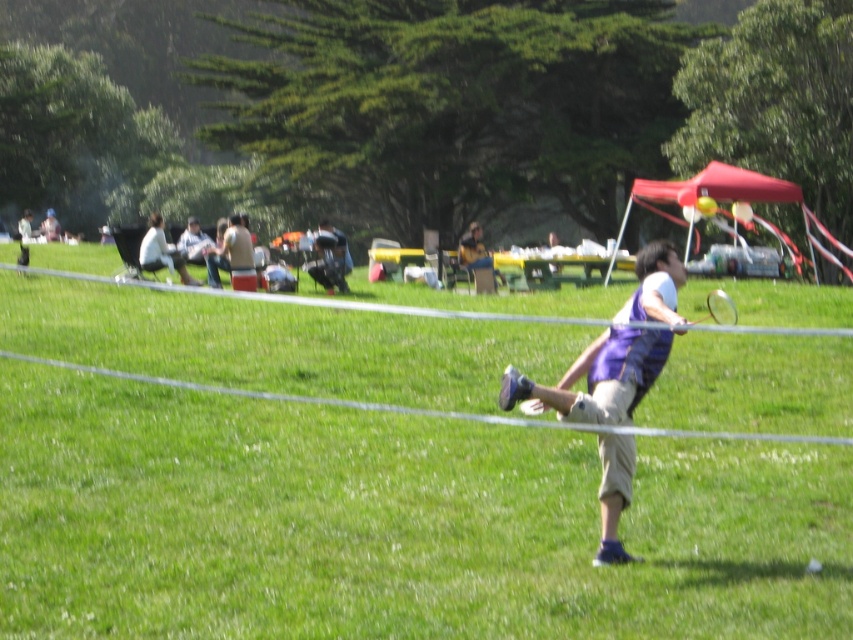
Is point (677, 493) positioned behind point (607, 500)?

Yes, it is behind point (607, 500).

What do you see at coordinates (370, 481) in the screenshot? I see `green grassy field at center` at bounding box center [370, 481].

Is point (544, 620) closer to camera compared to point (624, 346)?

Yes, point (544, 620) is closer to viewer.

Identify the location of green grassy field at center. This screenshot has width=853, height=640. (370, 481).

Does green grassy field at center have a lesser width compared to purple fabric shirt at center?

No, green grassy field at center is not thinner than purple fabric shirt at center.

Is the position of green grassy field at center less distant than that of purple fabric shirt at center?

That is True.

Does point (531, 476) lie behind point (473, 241)?

No.

This screenshot has width=853, height=640. Find the location of `green grassy field at center`. green grassy field at center is located at coordinates pyautogui.click(x=370, y=481).

From the picture: Is purple striped vest at center above light brown fabric jacket at upper left?

No, purple striped vest at center is not above light brown fabric jacket at upper left.

Does point (608, 529) come in front of point (178, 253)?

Yes.

Identify the location of purple striped vest at center. (598, 378).